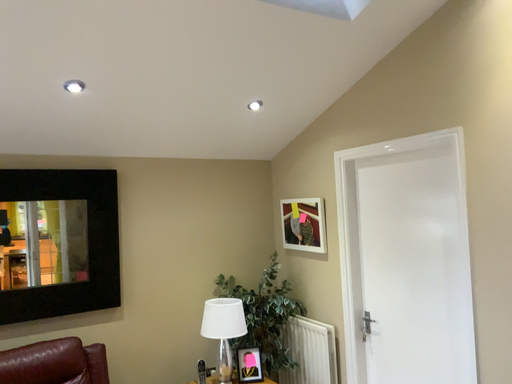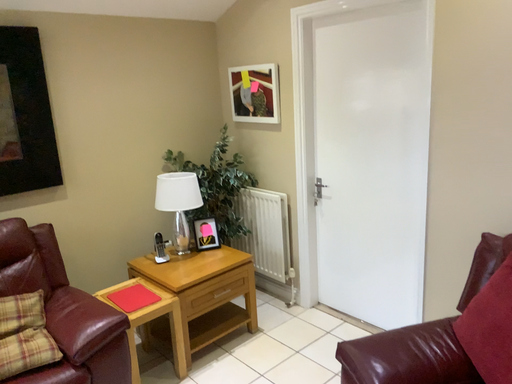
Question: How did the camera likely rotate when shooting the video?

Choices:
 (A) rotated downward
 (B) rotated upward

Answer: (A)